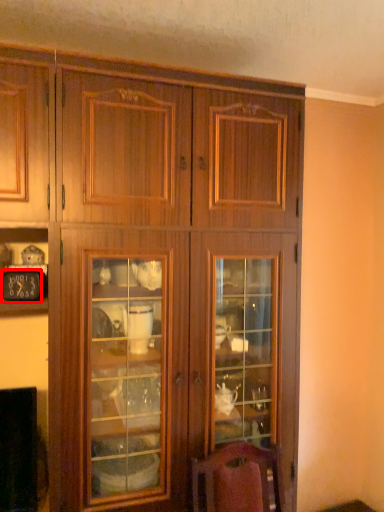
Question: From the image's perspective, what is the correct spatial positioning of clock (annotated by the red box) in reference to cupboard?

Choices:
 (A) below
 (B) above

Answer: (B)